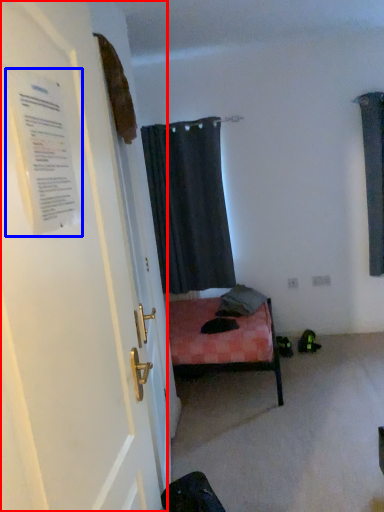
Question: Among these objects, which one is nearest to the camera, door (highlighted by a red box) or poster (highlighted by a blue box)?

Choices:
 (A) door
 (B) poster

Answer: (A)